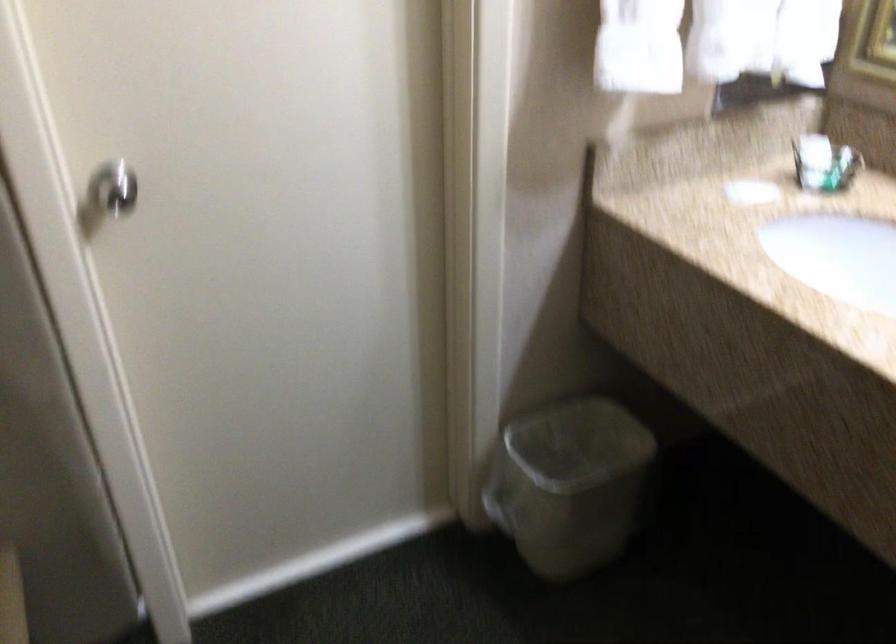
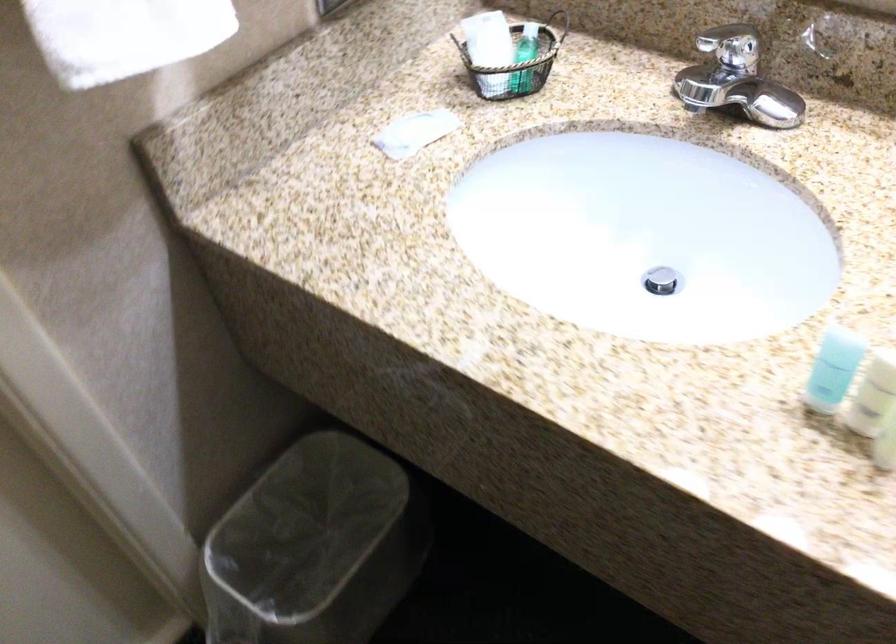
In the second image, find the point that corresponds to [581,464] in the first image.

(314, 547)